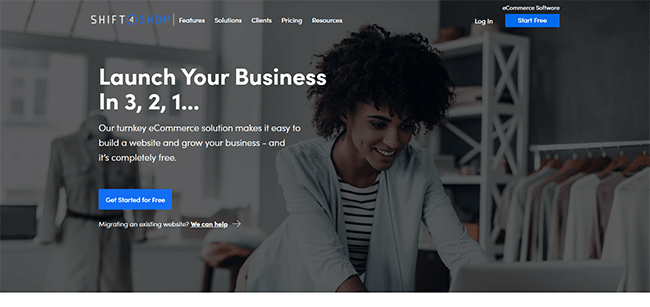
The image size is (650, 307). Find the location of `retail clothing rack`. retail clothing rack is located at coordinates (488, 109).